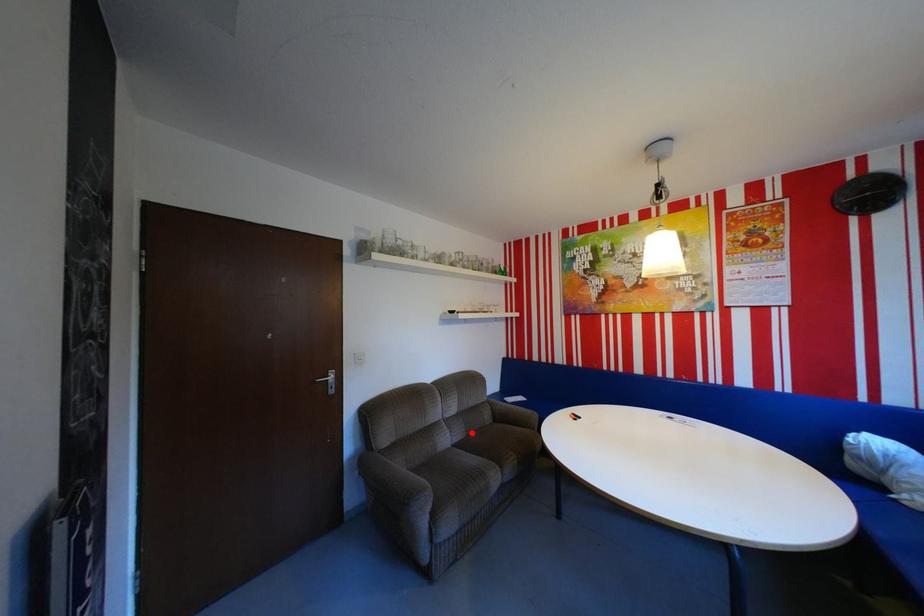
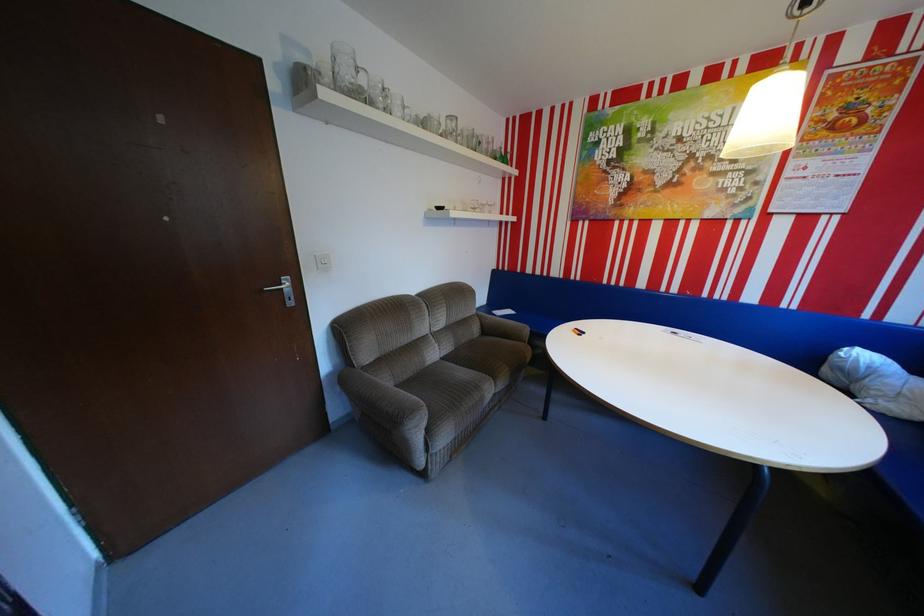
Question: A red point is marked in image1. In image2, is the corresponding 3D point closer to the camera or farther? Reply with the corresponding letter.

Choices:
 (A) The corresponding 3D point is closer.
 (B) The corresponding 3D point is farther.

Answer: (A)